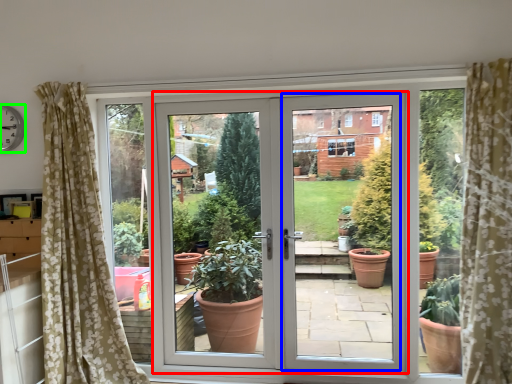
Question: Estimate the real-world distances between objects in this image. Which object is farther from door (highlighted by a red box), screen door (highlighted by a blue box) or clock (highlighted by a green box)?

Choices:
 (A) screen door
 (B) clock

Answer: (B)